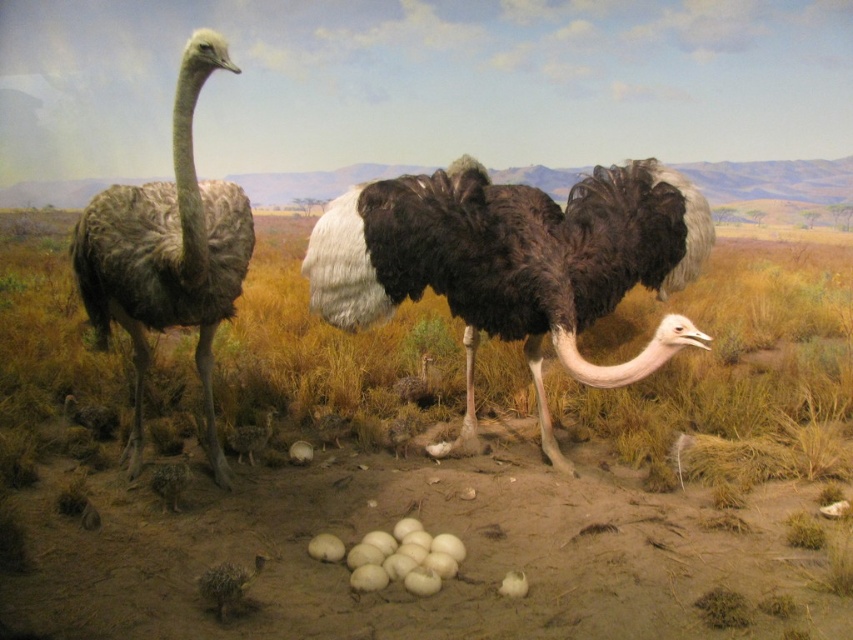
You are an observer looking at the diorama. You notice two objects labeled dark brown feathers at center and dark brown feathers at left. Which of these is located closer to the front of the diorama?

The dark brown feathers at center is positioned under the dark brown feathers at left, so the dark brown feathers at left is closer to the front of the diorama.

You are an observer looking at the diorama of the African savanna. There are two points marked in the image, point 1 at coordinates point 1 at point (x=682, y=474) and point 2 at point (x=216, y=436). Which point is closer to you?

Point 1 at point (x=682, y=474) is closer to you because it is further to the viewer than point 2 at point (x=216, y=436).